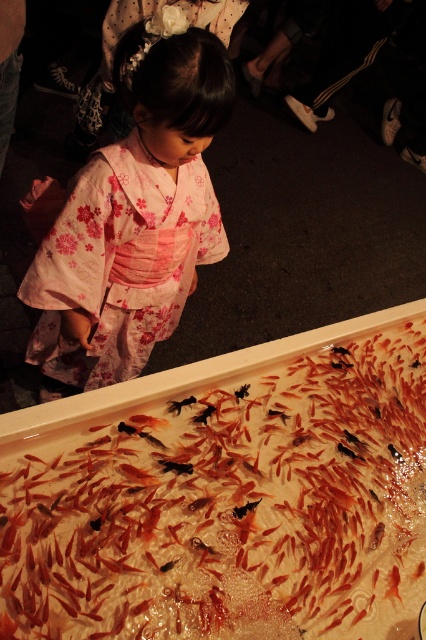
You are a food vendor at a festival and need to place a new tray of sushi near the tank where the girl is standing. The tray must be placed at the exact coordinates of point (x=227, y=496). Can you confirm if placing the tray at this point will be stable and not obstruct the girl? Please consider the description of the point and the scene.

The point (x=227, y=496) marks a translucent plastic tray at lower center, which is already present. Placing another tray here would obstruct the existing one and may not be stable as the area is occupied.

You are a photographer standing at the event and want to take a clear photo of the translucent plastic tray at lower center. Considering your current position, is the distance sufficient to capture the tray in focus without moving closer?

The translucent plastic tray at lower center is 35.96 inches from viewer, which is a sufficient distance for a photographer to capture it in focus without needing to move closer.